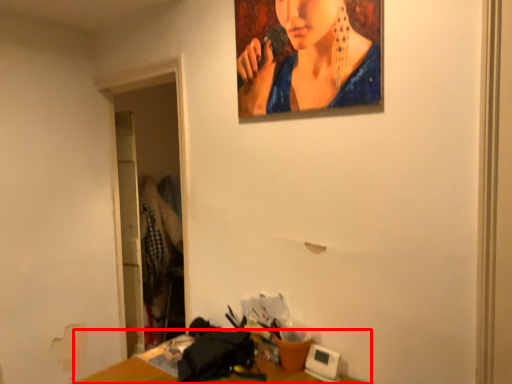
Question: From the image, what is the correct spatial relationship of table (annotated by the red box) in relation to person?

Choices:
 (A) right
 (B) left

Answer: (B)